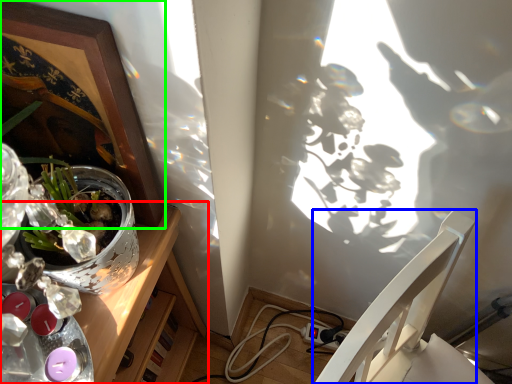
Question: Based on their relative distances, which object is farther from desk (highlighted by a red box)? Choose from chair (highlighted by a blue box) and picture frame (highlighted by a green box).

Choices:
 (A) chair
 (B) picture frame

Answer: (A)